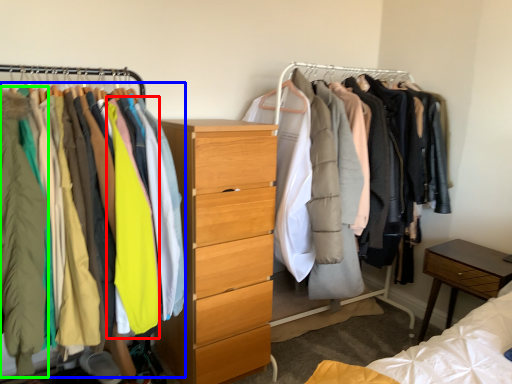
Question: Based on their relative distances, which object is nearer to clothing (highlighted by a red box)? Choose from clothing (highlighted by a blue box) and clothing (highlighted by a green box).

Choices:
 (A) clothing
 (B) clothing

Answer: (A)